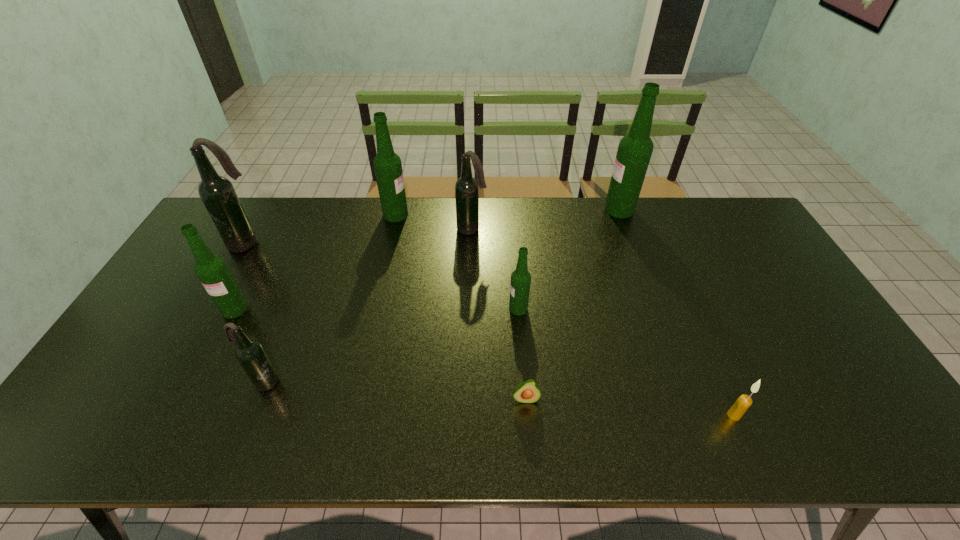
At what (x,y) coordinates should I click in order to perform the action: click on object located in the left edge section of the desktop. Please return your answer as a coordinate pair (x, y). This screenshot has height=540, width=960. Looking at the image, I should click on (217, 193).

Locate an element on the screen. The height and width of the screenshot is (540, 960). object that is positioned at the far left corner is located at coordinates (217, 193).

You are a GUI agent. You are given a task and a screenshot of the screen. Output one action in this format:
    pyautogui.click(x=<x>, y=<y>)
    Task: Click on the vacant point at the far edge
    Image resolution: width=960 pixels, height=540 pixels.
    Given the screenshot: What is the action you would take?
    click(411, 201)

Where is `vacant space at the near edge of the desktop`? The height and width of the screenshot is (540, 960). vacant space at the near edge of the desktop is located at coordinates (813, 415).

Identify the location of vacant space at the left edge of the desktop. (171, 310).

Identify the location of vacant space at the right edge. The image size is (960, 540). (789, 297).

Image resolution: width=960 pixels, height=540 pixels. I want to click on vacant area at the far right corner, so click(704, 206).

Locate an element on the screen. The image size is (960, 540). unoccupied position between the fourth object from left to right and the biggest green beer bottle is located at coordinates (508, 212).

The image size is (960, 540). In order to click on unoccupied area between the leftmost dark beer bottle and the nearest object in this screenshot , I will do `click(490, 329)`.

The image size is (960, 540). I want to click on free area in between the second smallest green beer bottle and the rightmost dark beer bottle, so click(353, 269).